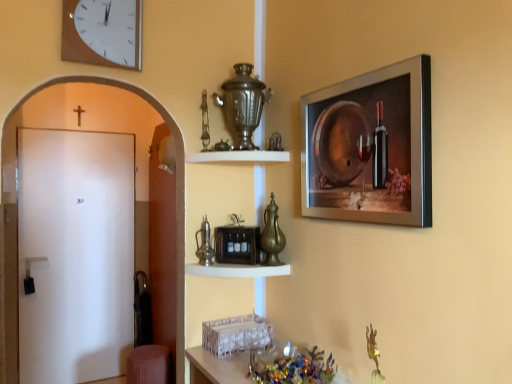
In order to click on vacant space to the left of gold metallic vase at center in this screenshot , I will do `click(241, 269)`.